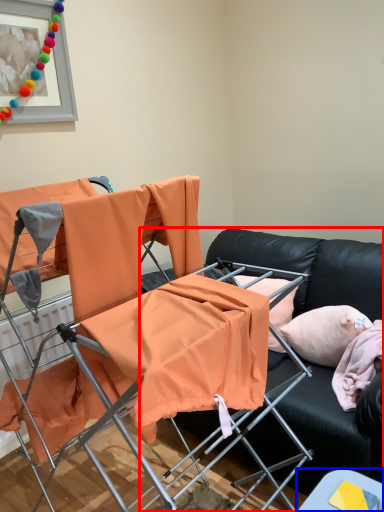
Question: Which point is closer to the camera, studio couch (highlighted by a red box) or table (highlighted by a blue box)?

Choices:
 (A) studio couch
 (B) table

Answer: (B)